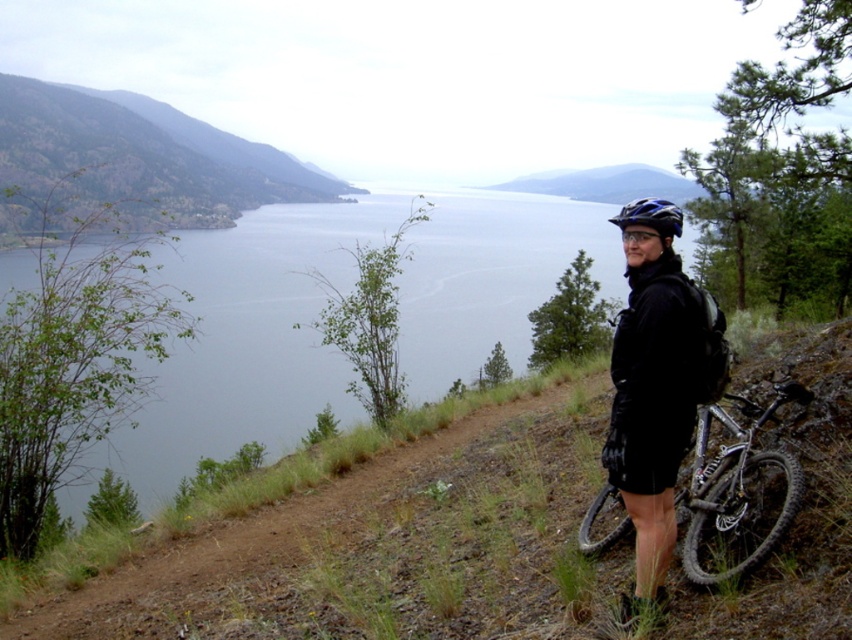
You are a hiker who wants to take a photo of the blue water at upper center and the black matte jacket at right. Which object should you focus on first if you want to capture both in one frame without moving the camera?

The blue water at upper center is larger in size than the black matte jacket at right, so you should focus on the blue water at upper center first to ensure it fills the frame appropriately before adjusting for the smaller black matte jacket at right.